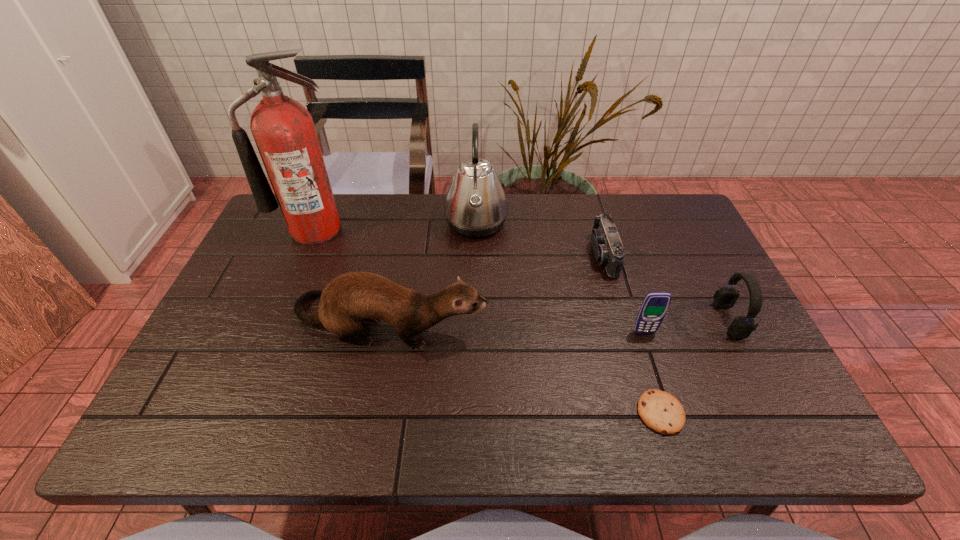
The height and width of the screenshot is (540, 960). What are the coordinates of `vacant region at the far right corner of the desktop` in the screenshot? It's located at (648, 203).

The height and width of the screenshot is (540, 960). I want to click on vacant region between the sixth shortest object and the second shortest object, so click(540, 239).

Image resolution: width=960 pixels, height=540 pixels. What are the coordinates of `free space between the tallest object and the camcorder` in the screenshot? It's located at (460, 242).

Locate an element on the screen. vacant space that's between the headset and the nearest object is located at coordinates (695, 366).

Identify the location of free space between the rightmost object and the tallest object. (522, 274).

The height and width of the screenshot is (540, 960). Find the location of `empty space that is in between the cellular telephone and the shortest object`. empty space that is in between the cellular telephone and the shortest object is located at coordinates (653, 373).

Find the location of `unoccupied area between the kettle and the shortest object`. unoccupied area between the kettle and the shortest object is located at coordinates (568, 318).

At what (x,y) coordinates should I click in order to perform the action: click on unoccupied area between the cellular telephone and the camcorder. Please return your answer as a coordinate pair (x, y). This screenshot has height=540, width=960. Looking at the image, I should click on (624, 294).

This screenshot has height=540, width=960. What are the coordinates of `free space between the second shortest object and the cellular telephone` in the screenshot? It's located at (624, 294).

Locate an element on the screen. vacant area that lies between the headset and the ferret is located at coordinates (559, 321).